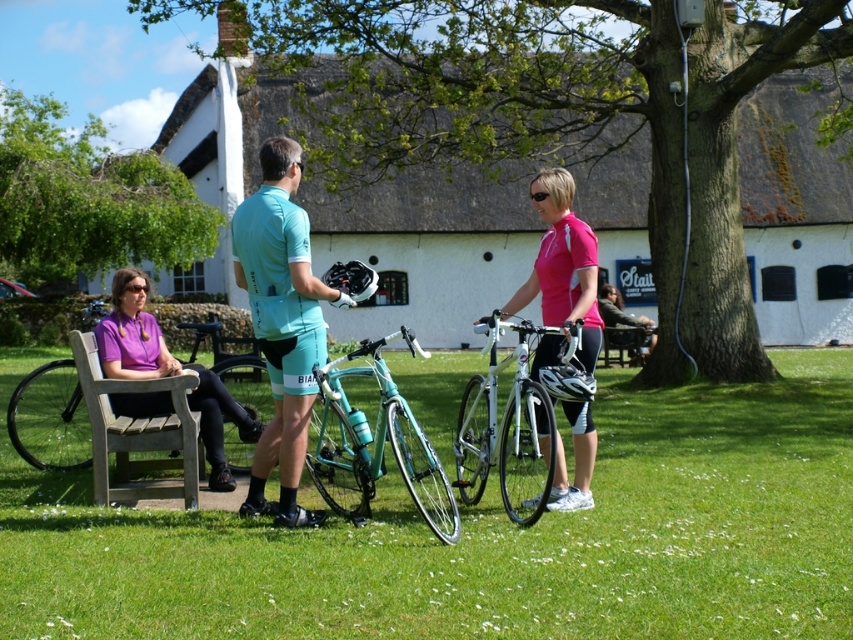
You are a photographer setting up a shot of the teal fabric jersey at center and the white metallic bicycle at center. Which object should you focus on first if you want to capture both clearly in the frame?

The teal fabric jersey at center is larger in size than the white metallic bicycle at center, so you should focus on the teal fabric jersey at center first to ensure it is in sharp focus before adjusting for the smaller bicycle.

You are planning to place a small potted plant between the pink matte jersey at center and the wooden park bench at left. Based on their positions, which object should the plant be closer to?

The pink matte jersey at center is positioned over the wooden park bench at left, so the plant should be placed closer to the wooden park bench at left to maintain balance between the two objects.